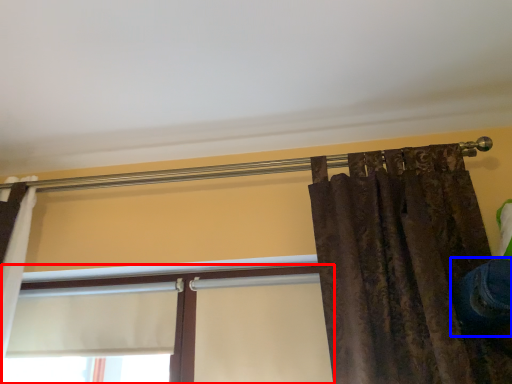
Question: Which point is further to the camera, window (highlighted by a red box) or jeans (highlighted by a blue box)?

Choices:
 (A) window
 (B) jeans

Answer: (A)